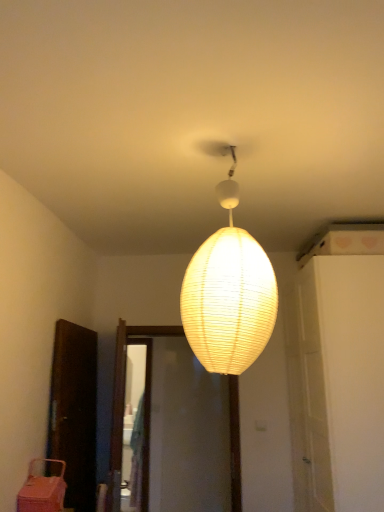
Question: Is point (46, 490) closer or farther from the camera than point (230, 315)?

Choices:
 (A) closer
 (B) farther

Answer: (B)

Question: Visually, is pink plastic basket at lower left positioned to the left or to the right of ivory paper lampshade at center?

Choices:
 (A) right
 (B) left

Answer: (B)

Question: Considering the real-world distances, which object is farthest from the white matte door at center right?

Choices:
 (A) ivory paper lampshade at center
 (B) pink plastic basket at lower left

Answer: (B)

Question: Which of these objects is positioned closest to the white matte door at center right?

Choices:
 (A) pink plastic basket at lower left
 (B) ivory paper lampshade at center

Answer: (B)